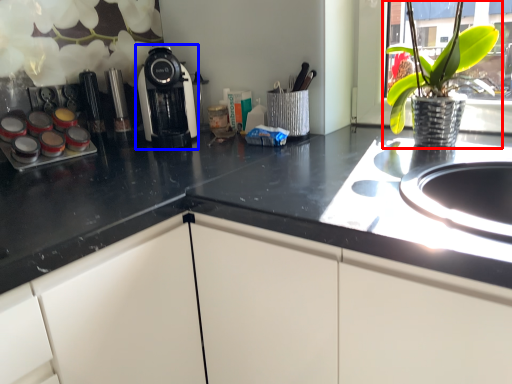
Question: Among these objects, which one is nearest to the camera, houseplant (highlighted by a red box) or kitchen appliance (highlighted by a blue box)?

Choices:
 (A) houseplant
 (B) kitchen appliance

Answer: (A)